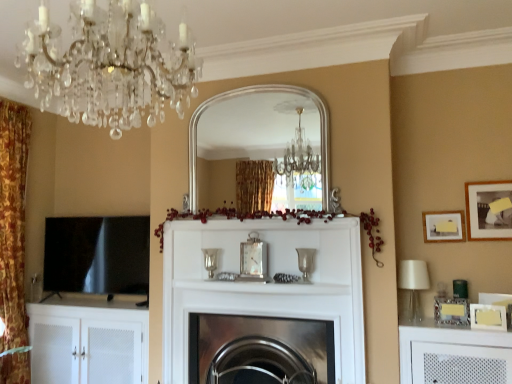
Locate an element on the screen. Image resolution: width=512 pixels, height=384 pixels. free space above silver/metallic mirror at center (from a real-world perspective) is located at coordinates (238, 79).